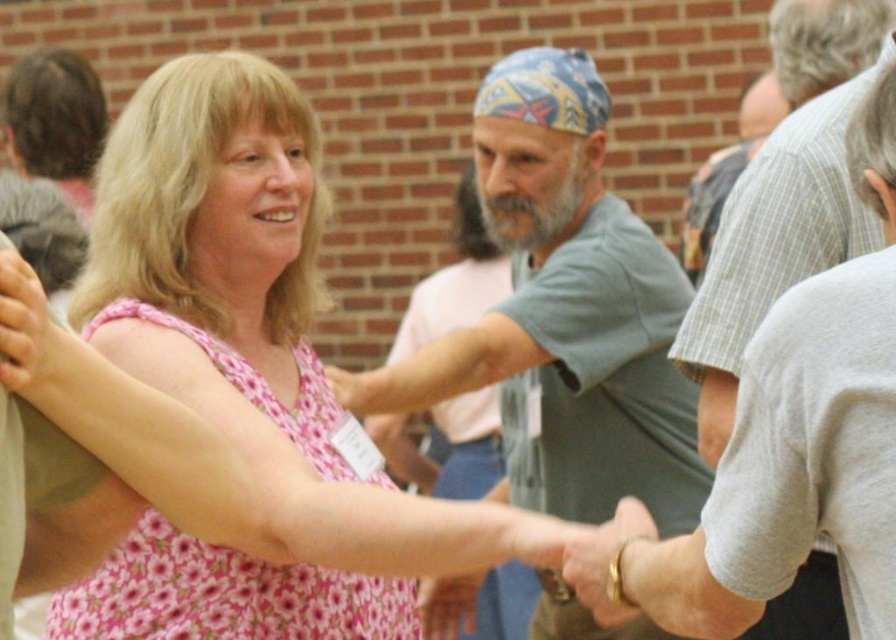
Question: Does gray cotton shirt at center appear on the left side of gray plaid shirt at center?

Choices:
 (A) no
 (B) yes

Answer: (B)

Question: Is gray plaid shirt at center positioned in front of gray checkered shirt at upper right?

Choices:
 (A) no
 (B) yes

Answer: (B)

Question: Which point is farther to the camera?

Choices:
 (A) gray plaid shirt at center
 (B) gray checkered shirt at upper right

Answer: (B)

Question: Which object appears closest to the camera in this image?

Choices:
 (A) gray plaid shirt at center
 (B) pink floral dress at center
 (C) gray checkered shirt at upper right

Answer: (B)

Question: Among these points, which one is farthest from the camera?

Choices:
 (A) (409, 593)
 (B) (695, 340)

Answer: (A)

Question: Does gray cotton shirt at center appear on the right side of gray checkered shirt at upper right?

Choices:
 (A) no
 (B) yes

Answer: (A)